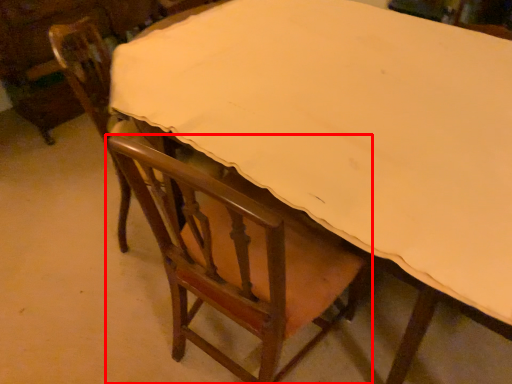
Question: From the image's perspective, where is chair (annotated by the red box) located in relation to chair in the image?

Choices:
 (A) below
 (B) above

Answer: (A)